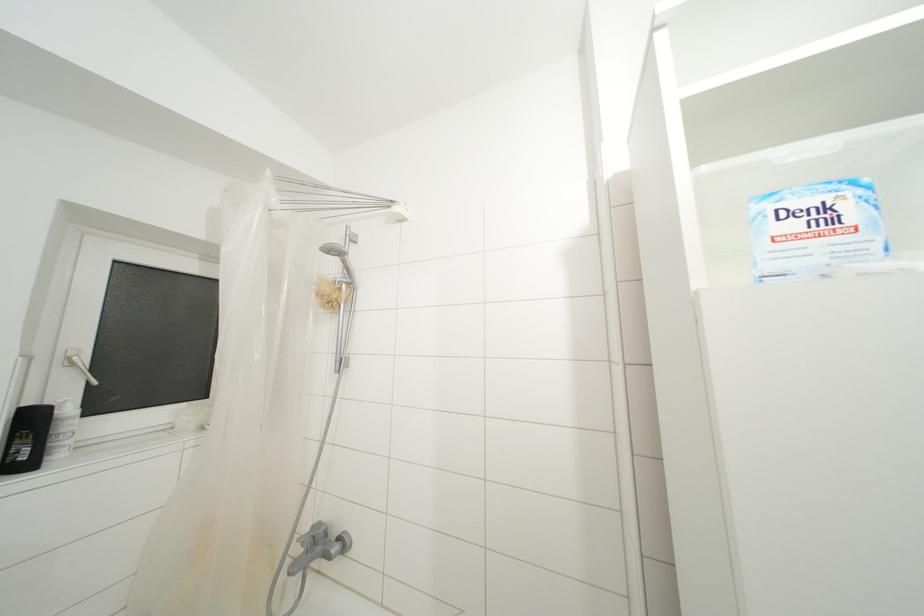
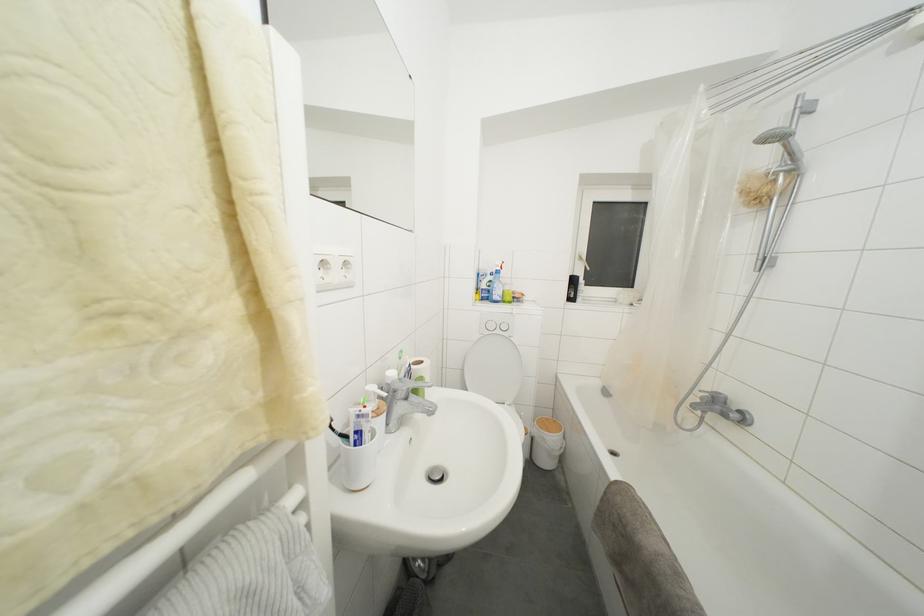
Locate, in the second image, the point that corresponds to [351,274] in the first image.

(796, 159)